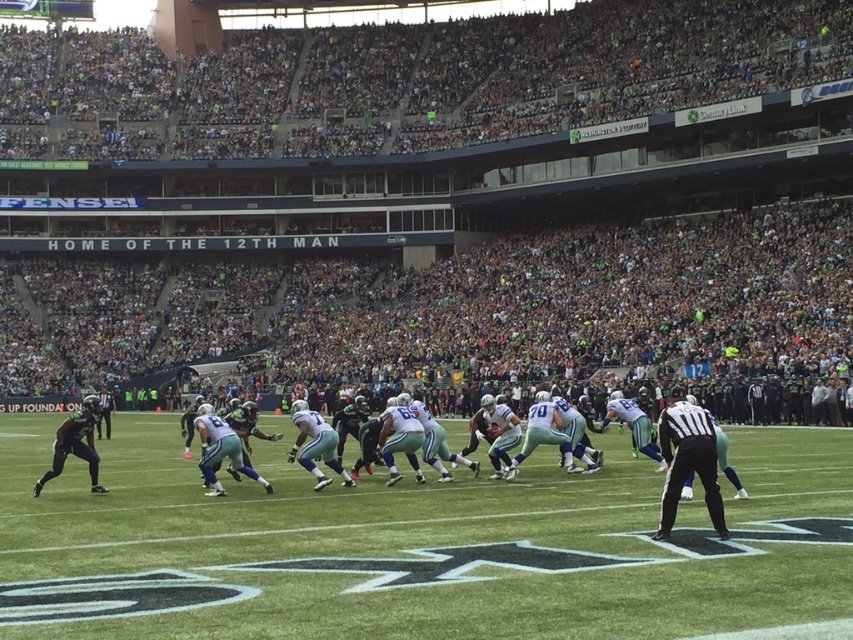
Does white turf at center have a lesser width compared to black uniform at right?

No, white turf at center is not thinner than black uniform at right.

Who is higher up, white turf at center or black uniform at right?

black uniform at right

Who is more forward, (815, 582) or (677, 458)?

Point (815, 582)

Where is `white turf at center`? white turf at center is located at coordinates pos(416,547).